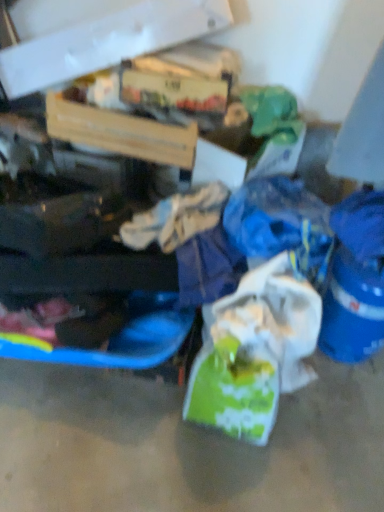
What do you see at coordinates (352, 309) in the screenshot?
I see `blue plastic bucket at lower right` at bounding box center [352, 309].

Describe the element at coordinates (254, 351) in the screenshot. I see `white matte plastic bag at center` at that location.

This screenshot has height=512, width=384. What do you see at coordinates (119, 131) in the screenshot?
I see `wooden crate at upper center, which is the 1th box from bottom to top` at bounding box center [119, 131].

In order to click on cardboard box at upper left, acting as the first box starting from the top in this screenshot , I will do `click(97, 36)`.

This screenshot has width=384, height=512. Identify the location of blue plastic bucket at lower right. (352, 309).

Considering the positions of objects cardboard box at upper left, arranged as the second box when ordered from the bottom, and blue plastic bucket at lower right in the image provided, who is in front, cardboard box at upper left, arranged as the second box when ordered from the bottom, or blue plastic bucket at lower right?

blue plastic bucket at lower right is in front.

Based on the photo, is cardboard box at upper left, acting as the first box starting from the top, directly adjacent to blue plastic bucket at lower right?

No, cardboard box at upper left, acting as the first box starting from the top, is not touching blue plastic bucket at lower right.

Is cardboard box at upper left, acting as the first box starting from the top, aimed at blue plastic bucket at lower right?

No, cardboard box at upper left, acting as the first box starting from the top, does not turn towards blue plastic bucket at lower right.

From a real-world perspective, which object stands above the other?

cardboard box at upper left, arranged as the second box when ordered from the bottom, is physically above.

Is blue plastic bucket at lower right in front of cardboard box at upper left, arranged as the second box when ordered from the bottom?

Yes.

Considering the sizes of objects blue plastic bucket at lower right and cardboard box at upper left, acting as the first box starting from the top, in the image provided, who is smaller, blue plastic bucket at lower right or cardboard box at upper left, acting as the first box starting from the top,?

With smaller size is blue plastic bucket at lower right.

Visually, is blue plastic bucket at lower right positioned to the left or to the right of cardboard box at upper left, acting as the first box starting from the top?

In the image, blue plastic bucket at lower right appears on the right side of cardboard box at upper left, acting as the first box starting from the top.

From the image's perspective, which object appears higher, blue plastic bucket at lower right or cardboard box at upper left, acting as the first box starting from the top?

cardboard box at upper left, acting as the first box starting from the top, from the image's perspective.

How many degrees apart are the facing directions of white matte plastic bag at center and cardboard box at upper left, arranged as the second box when ordered from the bottom?

9.96 degrees.

Is white matte plastic bag at center not inside cardboard box at upper left, acting as the first box starting from the top?

Indeed, white matte plastic bag at center is completely outside cardboard box at upper left, acting as the first box starting from the top.

Does white matte plastic bag at center have a lesser width compared to cardboard box at upper left, arranged as the second box when ordered from the bottom?

Correct, the width of white matte plastic bag at center is less than that of cardboard box at upper left, arranged as the second box when ordered from the bottom.

Is white matte plastic bag at center with cardboard box at upper left, arranged as the second box when ordered from the bottom?

No, white matte plastic bag at center is not beside cardboard box at upper left, arranged as the second box when ordered from the bottom.

Considering the sizes of objects blue plastic bucket at lower right and wooden crate at upper center, which ranks as the second box in top-to-bottom order, in the image provided, who is shorter, blue plastic bucket at lower right or wooden crate at upper center, which ranks as the second box in top-to-bottom order,?

With less height is wooden crate at upper center, which ranks as the second box in top-to-bottom order.

Is blue plastic bucket at lower right next to wooden crate at upper center, which ranks as the second box in top-to-bottom order, and touching it?

No, blue plastic bucket at lower right is not next to wooden crate at upper center, which ranks as the second box in top-to-bottom order.

Looking at this image, from the image's perspective, is blue plastic bucket at lower right under wooden crate at upper center, which is the 1th box from bottom to top?

Yes.

Between blue plastic bucket at lower right and wooden crate at upper center, which is the 1th box from bottom to top, which one is positioned in front?

blue plastic bucket at lower right.

Which object is more forward, wooden crate at upper center, which is the 1th box from bottom to top, or white matte plastic bag at center?

white matte plastic bag at center is in front.

From the image's perspective, which one is positioned lower, wooden crate at upper center, which ranks as the second box in top-to-bottom order, or white matte plastic bag at center?

From the image's view, white matte plastic bag at center is below.

Based on their positions, is wooden crate at upper center, which ranks as the second box in top-to-bottom order, located to the left or right of white matte plastic bag at center?

wooden crate at upper center, which ranks as the second box in top-to-bottom order, is to the left of white matte plastic bag at center.

Can we say wooden crate at upper center, which is the 1th box from bottom to top, lies outside white matte plastic bag at center?

Yes, wooden crate at upper center, which is the 1th box from bottom to top, is not within white matte plastic bag at center.

Is cardboard box at upper left, arranged as the second box when ordered from the bottom, taller than wooden crate at upper center, which is the 1th box from bottom to top?

Correct, cardboard box at upper left, arranged as the second box when ordered from the bottom, is much taller as wooden crate at upper center, which is the 1th box from bottom to top.

Does cardboard box at upper left, arranged as the second box when ordered from the bottom, have a lesser width compared to wooden crate at upper center, which ranks as the second box in top-to-bottom order?

Yes, cardboard box at upper left, arranged as the second box when ordered from the bottom, is thinner than wooden crate at upper center, which ranks as the second box in top-to-bottom order.

Which is more to the right, cardboard box at upper left, acting as the first box starting from the top, or wooden crate at upper center, which ranks as the second box in top-to-bottom order?

wooden crate at upper center, which ranks as the second box in top-to-bottom order, is more to the right.

Is cardboard box at upper left, arranged as the second box when ordered from the bottom, positioned far away from wooden crate at upper center, which ranks as the second box in top-to-bottom order?

No, cardboard box at upper left, arranged as the second box when ordered from the bottom, is not far from wooden crate at upper center, which ranks as the second box in top-to-bottom order.

Between point (128, 117) and point (374, 285), which one is positioned behind?

Positioned behind is point (128, 117).

From the image's perspective, between wooden crate at upper center, which ranks as the second box in top-to-bottom order, and blue plastic bucket at lower right, which one is located above?

wooden crate at upper center, which ranks as the second box in top-to-bottom order, is shown above in the image.

Which is more to the right, wooden crate at upper center, which is the 1th box from bottom to top, or blue plastic bucket at lower right?

Positioned to the right is blue plastic bucket at lower right.

From a real-world perspective, relative to blue plastic bucket at lower right, is wooden crate at upper center, which ranks as the second box in top-to-bottom order, vertically above or below?

In terms of real-world spatial position, wooden crate at upper center, which ranks as the second box in top-to-bottom order, is above blue plastic bucket at lower right.

Identify the location of bucket below the cardboard box at upper left, arranged as the second box when ordered from the bottom (from a real-world perspective). The height and width of the screenshot is (512, 384). (352, 309).

Where is `the 2nd box positioned above the blue plastic bucket at lower right (from a real-world perspective)`? The height and width of the screenshot is (512, 384). the 2nd box positioned above the blue plastic bucket at lower right (from a real-world perspective) is located at coordinates (97, 36).

Considering their positions, is wooden crate at upper center, which is the 1th box from bottom to top, positioned closer to white matte plastic bag at center than cardboard box at upper left, acting as the first box starting from the top?

wooden crate at upper center, which is the 1th box from bottom to top.

Looking at the image, which one is located further to white matte plastic bag at center, cardboard box at upper left, acting as the first box starting from the top, or blue plastic bucket at lower right?

cardboard box at upper left, acting as the first box starting from the top, is further to white matte plastic bag at center.

In the scene shown: From the image, which object appears to be farther from blue plastic bucket at lower right, wooden crate at upper center, which ranks as the second box in top-to-bottom order, or white matte plastic bag at center?

wooden crate at upper center, which ranks as the second box in top-to-bottom order.

Estimate the real-world distances between objects in this image. Which object is further from blue plastic bucket at lower right, white matte plastic bag at center or wooden crate at upper center, which is the 1th box from bottom to top?

wooden crate at upper center, which is the 1th box from bottom to top.

Which object lies further to the anchor point blue plastic bucket at lower right, white matte plastic bag at center or cardboard box at upper left, acting as the first box starting from the top?

cardboard box at upper left, acting as the first box starting from the top, is further to blue plastic bucket at lower right.

Looking at this image, looking at the image, which one is located closer to cardboard box at upper left, acting as the first box starting from the top, wooden crate at upper center, which is the 1th box from bottom to top, or white matte plastic bag at center?

Based on the image, wooden crate at upper center, which is the 1th box from bottom to top, appears to be nearer to cardboard box at upper left, acting as the first box starting from the top.

When comparing their distances from cardboard box at upper left, arranged as the second box when ordered from the bottom, does blue plastic bucket at lower right or wooden crate at upper center, which ranks as the second box in top-to-bottom order, seem closer?

The object closer to cardboard box at upper left, arranged as the second box when ordered from the bottom, is wooden crate at upper center, which ranks as the second box in top-to-bottom order.

Considering their positions, is cardboard box at upper left, acting as the first box starting from the top, positioned further to blue plastic bucket at lower right than white matte plastic bag at center?

cardboard box at upper left, acting as the first box starting from the top, is positioned further to the anchor blue plastic bucket at lower right.

At what (x,y) coordinates should I click in order to perform the action: click on box between cardboard box at upper left, arranged as the second box when ordered from the bottom, and blue plastic bucket at lower right, in the horizontal direction. Please return your answer as a coordinate pair (x, y). This screenshot has width=384, height=512. Looking at the image, I should click on (x=119, y=131).

The image size is (384, 512). Identify the location of box between cardboard box at upper left, arranged as the second box when ordered from the bottom, and white matte plastic bag at center, in the vertical direction. (x=119, y=131).

Identify the location of bucket between cardboard box at upper left, acting as the first box starting from the top, and white matte plastic bag at center from top to bottom. The height and width of the screenshot is (512, 384). [352, 309].

Where is `bucket that lies between wooden crate at upper center, which is the 1th box from bottom to top, and white matte plastic bag at center from top to bottom`? The width and height of the screenshot is (384, 512). bucket that lies between wooden crate at upper center, which is the 1th box from bottom to top, and white matte plastic bag at center from top to bottom is located at coordinates (352, 309).